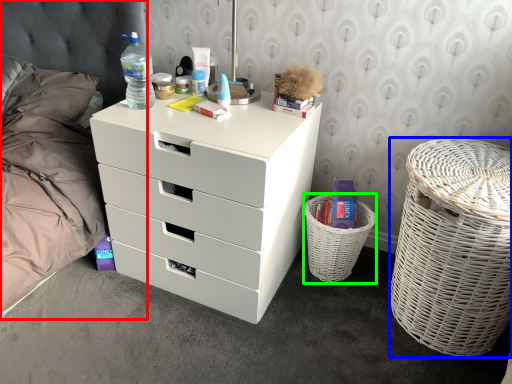
Question: Estimate the real-world distances between objects in this image. Which object is farther from bed (highlighted by a red box), basket container (highlighted by a blue box) or basket (highlighted by a green box)?

Choices:
 (A) basket container
 (B) basket

Answer: (A)